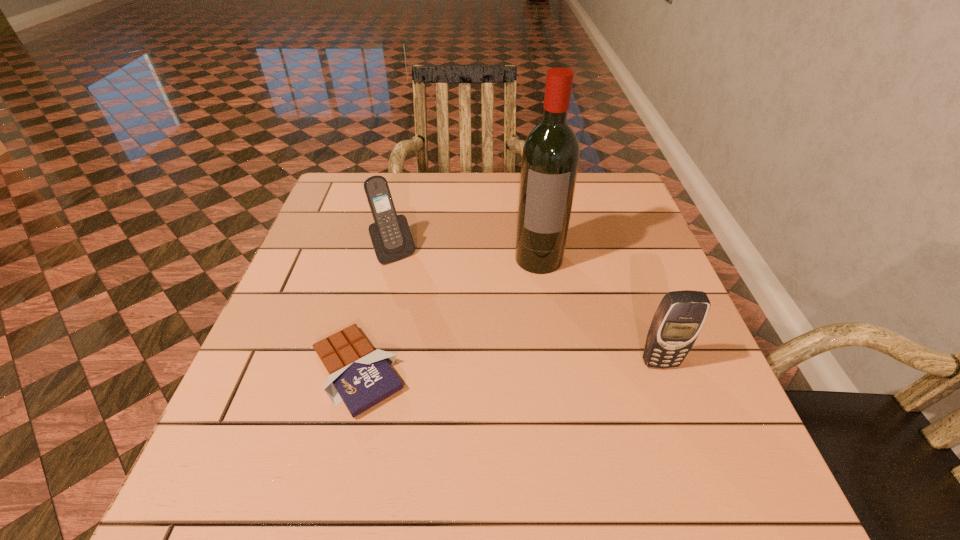
Locate an element on the screen. This screenshot has height=540, width=960. free space at the right edge is located at coordinates (664, 375).

Find the location of a particular element. This screenshot has width=960, height=540. vacant space at the far left corner of the desktop is located at coordinates (360, 187).

Image resolution: width=960 pixels, height=540 pixels. I want to click on vacant space at the far right corner of the desktop, so click(x=590, y=199).

This screenshot has height=540, width=960. In order to click on free space at the near right corner of the desktop in this screenshot , I will do `click(681, 404)`.

Identify the location of free space between the left cellular telephone and the tallest object. This screenshot has width=960, height=540. (467, 255).

The height and width of the screenshot is (540, 960). Identify the location of empty space that is in between the wine bottle and the rightmost object. (599, 310).

The image size is (960, 540). I want to click on vacant region between the left cellular telephone and the tallest object, so click(467, 255).

Image resolution: width=960 pixels, height=540 pixels. I want to click on unoccupied area between the second object from right to left and the rightmost object, so click(599, 310).

This screenshot has height=540, width=960. I want to click on unoccupied area between the chocolate bar and the tallest object, so click(x=448, y=314).

This screenshot has height=540, width=960. Identify the location of vacant point located between the shortest object and the wine bottle. (448, 314).